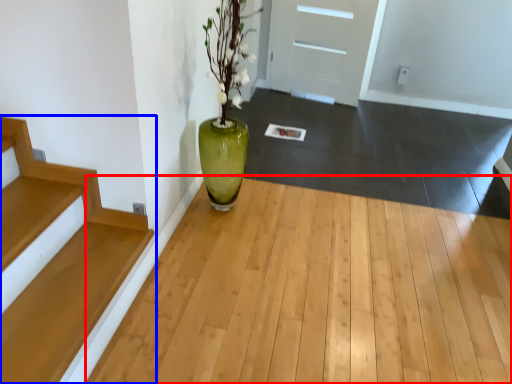
Question: Which point is further to the camera, corridor (highlighted by a red box) or stairs (highlighted by a blue box)?

Choices:
 (A) corridor
 (B) stairs

Answer: (B)